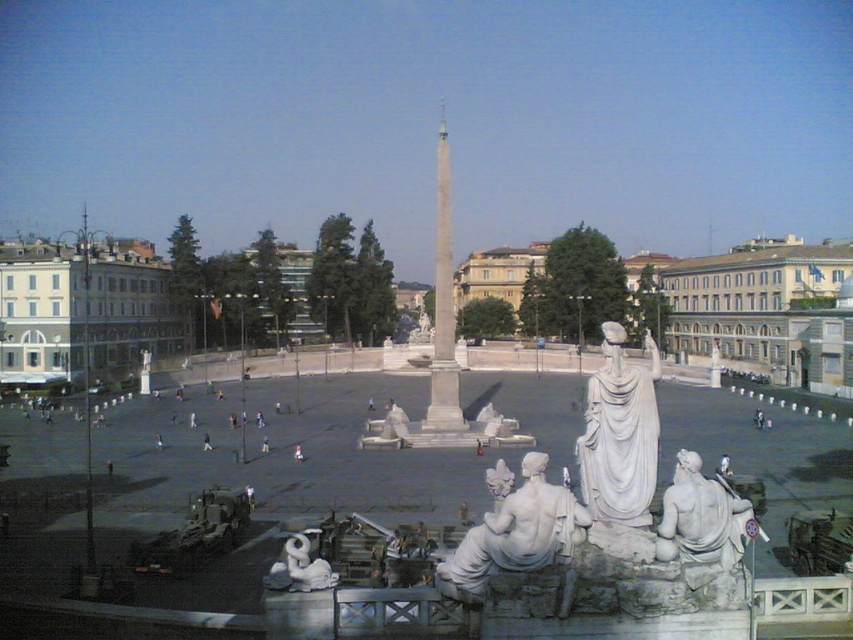
Looking at this image, you are standing in the public square and want to take a photo of the white marble statues at center. If your camera can focus up to 25 meters, will you be able to capture a clear photo from your current position?

The white marble statues at center are 24.76 meters away from the viewer. Since your camera can focus up to 25 meters, you can capture a clear photo from your current position as the distance is within the camera range.

You are a tourist standing in the public square and want to take a photo of both the white marble statues at center and the white marble statue at center. Which one should you focus on to ensure they both fit in the frame?

Since the white marble statues at center is wider than the white marble statue at center, you should focus on the white marble statues at center to ensure both fit in the frame.